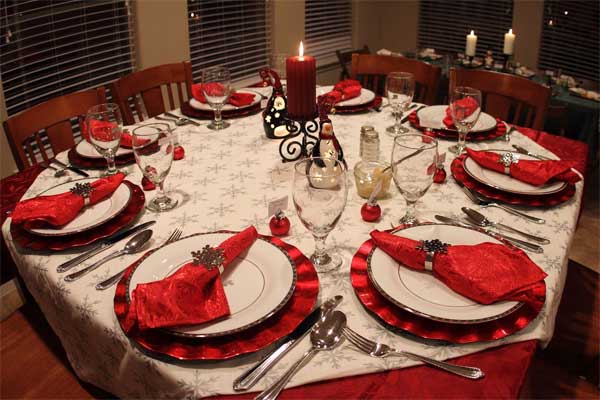
The image size is (600, 400). What are the coordinates of `red plate holders` in the screenshot? It's located at (284, 318), (365, 293), (469, 183), (492, 129), (369, 105), (248, 112), (118, 155), (127, 216).